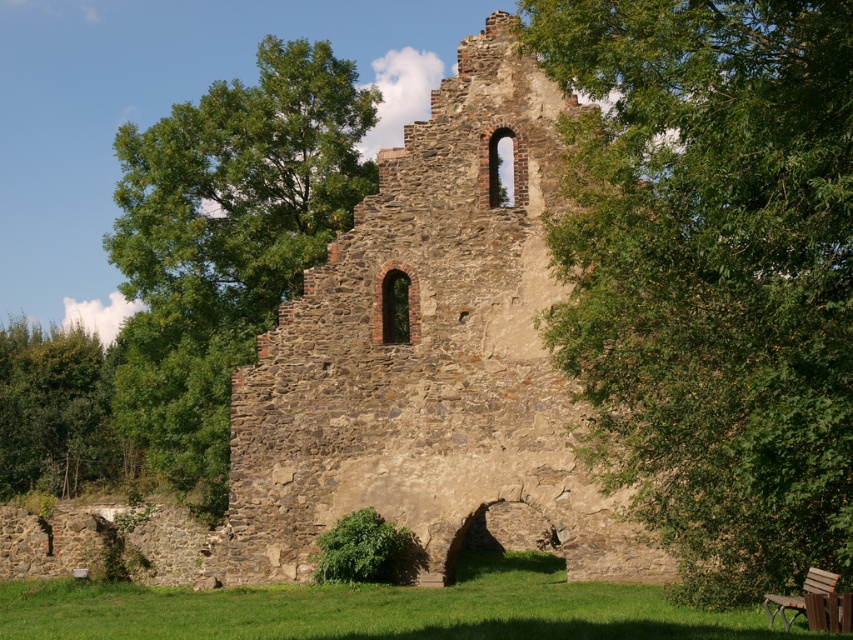
Question: Estimate the real-world distances between objects in this image. Which object is closer to the green leafy tree at upper left?

Choices:
 (A) wooden bench at lower right
 (B) green leafy tree at center

Answer: (B)

Question: Which point is farther from the camera taking this photo?

Choices:
 (A) (77, 445)
 (B) (341, 134)
 (C) (650, 108)
 (D) (786, 628)

Answer: (A)

Question: Which object is the closest to the green leafy tree at center?

Choices:
 (A) wooden bench at lower right
 (B) green leafy tree at left

Answer: (A)

Question: Is green leafy tree at center wider than wooden bench at lower right?

Choices:
 (A) no
 (B) yes

Answer: (B)

Question: Does green leafy tree at center have a larger size compared to wooden bench at lower right?

Choices:
 (A) yes
 (B) no

Answer: (A)

Question: Does green leafy tree at left have a larger size compared to wooden bench at lower right?

Choices:
 (A) yes
 (B) no

Answer: (A)